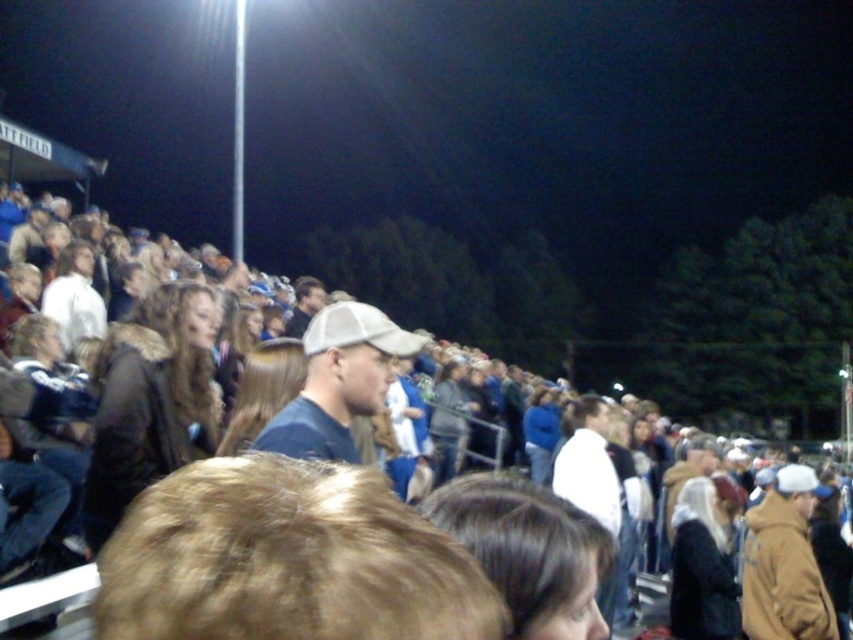
Question: Which point is closer to the camera?

Choices:
 (A) (379, 397)
 (B) (796, 625)

Answer: (A)

Question: Is matte blue shirt at center behind brown fuzzy jacket at right?

Choices:
 (A) yes
 (B) no

Answer: (B)

Question: Which point is farther to the camera?

Choices:
 (A) pos(332,410)
 (B) pos(799,504)
 (C) pos(78,218)

Answer: (C)

Question: Can you confirm if brown fabric jacket at center is positioned to the left of matte blue shirt at center?

Choices:
 (A) no
 (B) yes

Answer: (B)

Question: Which point is closer to the camera?

Choices:
 (A) (260, 436)
 (B) (173, 424)
 (C) (764, 536)

Answer: (A)

Question: Is brown fabric jacket at center thinner than brown fuzzy jacket at right?

Choices:
 (A) yes
 (B) no

Answer: (B)